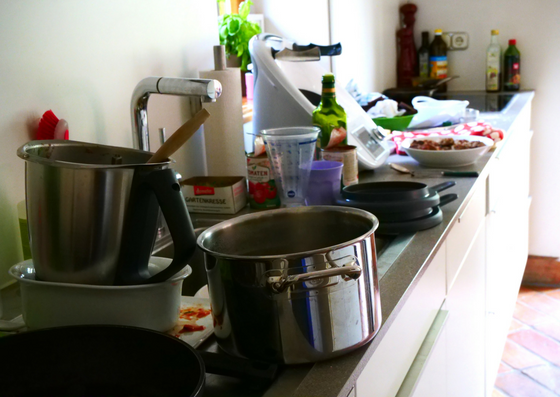
The height and width of the screenshot is (397, 560). Find the location of `faucet`. faucet is located at coordinates (194, 90).